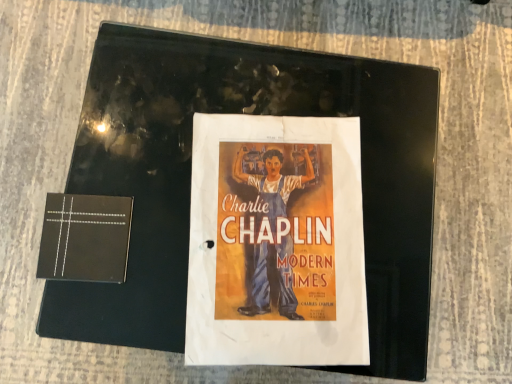
Question: Is matte paper poster at center far away from black matte paper at left?

Choices:
 (A) no
 (B) yes

Answer: (A)

Question: From the image's perspective, is matte paper poster at center located above black matte paper at left?

Choices:
 (A) yes
 (B) no

Answer: (A)

Question: Is matte paper poster at center further to the viewer compared to black matte paper at left?

Choices:
 (A) no
 (B) yes

Answer: (B)

Question: Is matte paper poster at center in contact with black matte paper at left?

Choices:
 (A) yes
 (B) no

Answer: (B)

Question: Considering the relative sizes of matte paper poster at center and black matte paper at left in the image provided, is matte paper poster at center bigger than black matte paper at left?

Choices:
 (A) yes
 (B) no

Answer: (A)

Question: Considering the relative sizes of matte paper poster at center and black matte paper at left in the image provided, is matte paper poster at center shorter than black matte paper at left?

Choices:
 (A) no
 (B) yes

Answer: (A)

Question: Is matte paper poster at center located within black matte paper at left?

Choices:
 (A) no
 (B) yes

Answer: (A)

Question: Is black matte paper at left directly adjacent to matte paper poster at center?

Choices:
 (A) yes
 (B) no

Answer: (B)

Question: Does black matte paper at left have a smaller size compared to matte paper poster at center?

Choices:
 (A) yes
 (B) no

Answer: (A)

Question: Is black matte paper at left far from matte paper poster at center?

Choices:
 (A) yes
 (B) no

Answer: (B)

Question: Is black matte paper at left behind matte paper poster at center?

Choices:
 (A) no
 (B) yes

Answer: (A)

Question: From the image's perspective, is black matte paper at left located beneath matte paper poster at center?

Choices:
 (A) no
 (B) yes

Answer: (B)

Question: Is black matte paper at left taller or shorter than matte paper poster at center?

Choices:
 (A) short
 (B) tall

Answer: (A)